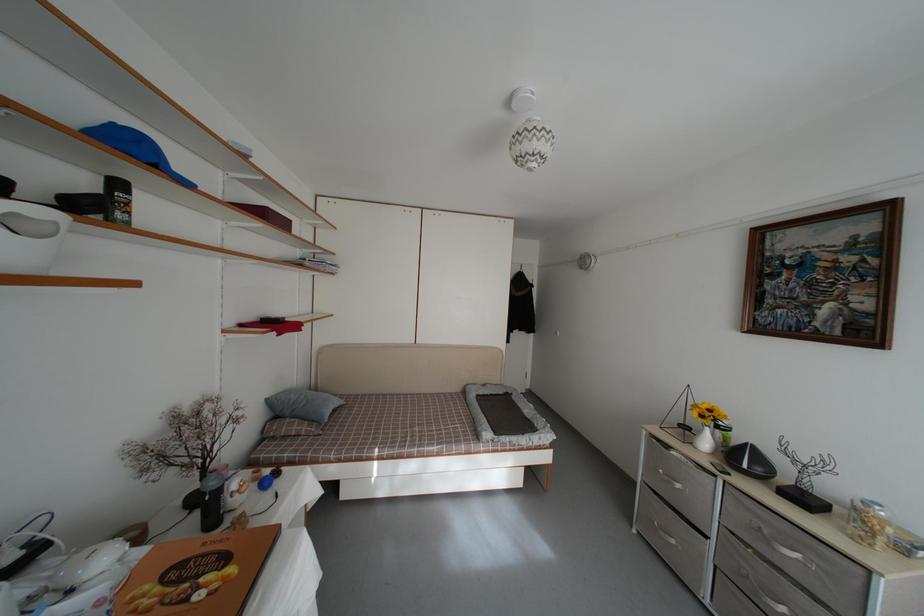
Describe the element at coordinates (402, 419) in the screenshot. The image size is (924, 616). I see `a sofa sitting surface` at that location.